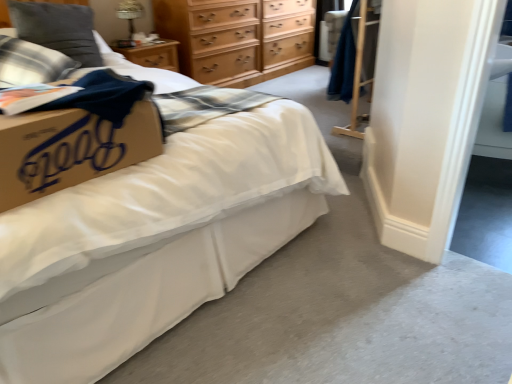
Question: From a real-world perspective, is plaid fabric pillow at upper left, acting as the second pillow starting from the top, located higher than light brown wooden chest of drawers at upper center?

Choices:
 (A) no
 (B) yes

Answer: (B)

Question: Is plaid fabric pillow at upper left, which appears as the first pillow when ordered from the bottom, turned away from light brown wooden chest of drawers at upper center?

Choices:
 (A) yes
 (B) no

Answer: (B)

Question: Does plaid fabric pillow at upper left, acting as the second pillow starting from the top, have a larger size compared to light brown wooden chest of drawers at upper center?

Choices:
 (A) yes
 (B) no

Answer: (B)

Question: Is plaid fabric pillow at upper left, acting as the second pillow starting from the top, further to the viewer compared to light brown wooden chest of drawers at upper center?

Choices:
 (A) no
 (B) yes

Answer: (A)

Question: Is plaid fabric pillow at upper left, acting as the second pillow starting from the top, aimed at light brown wooden chest of drawers at upper center?

Choices:
 (A) yes
 (B) no

Answer: (B)

Question: Would you say white matte bed at center is to the left or to the right of plaid fabric pillow at upper left, which appears as the first pillow when ordered from the bottom, in the picture?

Choices:
 (A) right
 (B) left

Answer: (A)

Question: Looking at their shapes, would you say white matte bed at center is wider or thinner than plaid fabric pillow at upper left, which appears as the first pillow when ordered from the bottom?

Choices:
 (A) wide
 (B) thin

Answer: (A)

Question: From a real-world perspective, is white matte bed at center positioned above or below plaid fabric pillow at upper left, which appears as the first pillow when ordered from the bottom?

Choices:
 (A) above
 (B) below

Answer: (B)

Question: Considering the positions of point (203, 205) and point (10, 84), is point (203, 205) closer or farther from the camera than point (10, 84)?

Choices:
 (A) closer
 (B) farther

Answer: (A)

Question: Based on their sizes in the image, would you say plaid fabric pillow at upper left, which appears as the first pillow when ordered from the bottom, is bigger or smaller than white matte bed at center?

Choices:
 (A) big
 (B) small

Answer: (B)

Question: Is plaid fabric pillow at upper left, which appears as the first pillow when ordered from the bottom, in front of or behind white matte bed at center in the image?

Choices:
 (A) front
 (B) behind

Answer: (B)

Question: From the image's perspective, is plaid fabric pillow at upper left, which appears as the first pillow when ordered from the bottom, positioned above or below white matte bed at center?

Choices:
 (A) above
 (B) below

Answer: (A)

Question: Is plaid fabric pillow at upper left, which appears as the first pillow when ordered from the bottom, inside the boundaries of white matte bed at center, or outside?

Choices:
 (A) inside
 (B) outside

Answer: (A)

Question: From a real-world perspective, is plaid fabric pillow at upper left, acting as the second pillow starting from the top, physically located above or below plush gray pillow at upper left, which is the 2th pillow in bottom-to-top order?

Choices:
 (A) above
 (B) below

Answer: (B)

Question: Considering their positions, is plaid fabric pillow at upper left, acting as the second pillow starting from the top, located in front of or behind plush gray pillow at upper left, which is the 2th pillow in bottom-to-top order?

Choices:
 (A) front
 (B) behind

Answer: (A)